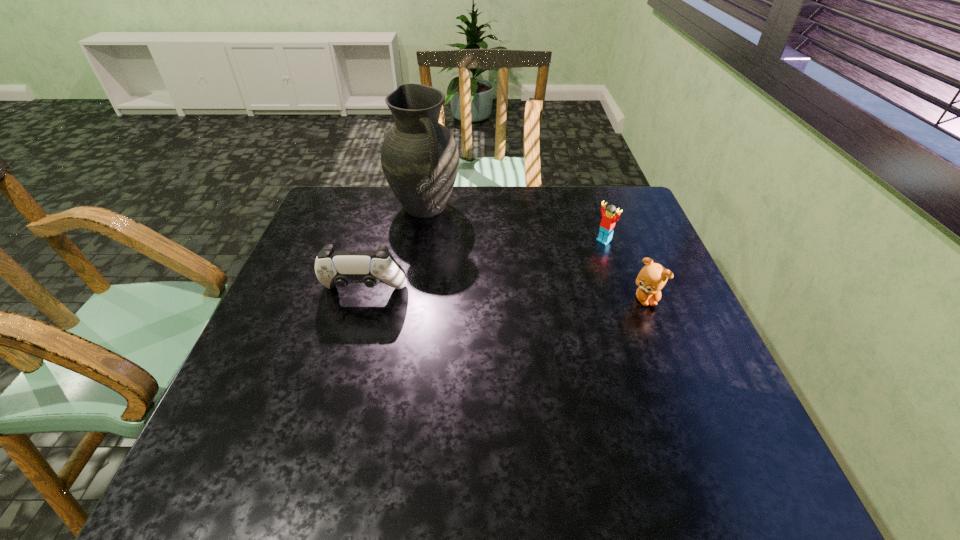
This screenshot has width=960, height=540. I want to click on empty location between the pitcher and the Lego, so click(515, 224).

This screenshot has height=540, width=960. Identify the location of vacant area that lies between the control and the teddy bear. (505, 296).

Choose which object is the nearest neighbor to the control. Please provide its 2D coordinates. Your answer should be formatted as a tuple, i.e. [(x, y)], where the tuple contains the x and y coordinates of a point satisfying the conditions above.

[(419, 156)]

Identify the location of object that can be found as the third closest to the tallest object. (652, 278).

Find the location of a particular element. This screenshot has width=960, height=540. vacant area that satisfies the following two spatial constraints: 1. on the front side of the third nearest object; 2. on the left side of the tallest object is located at coordinates (420, 241).

At what (x,y) coordinates should I click in order to perform the action: click on free location that satisfies the following two spatial constraints: 1. on the front side of the farthest object; 2. on the left side of the third nearest object. Please return your answer as a coordinate pair (x, y). The width and height of the screenshot is (960, 540). Looking at the image, I should click on (420, 241).